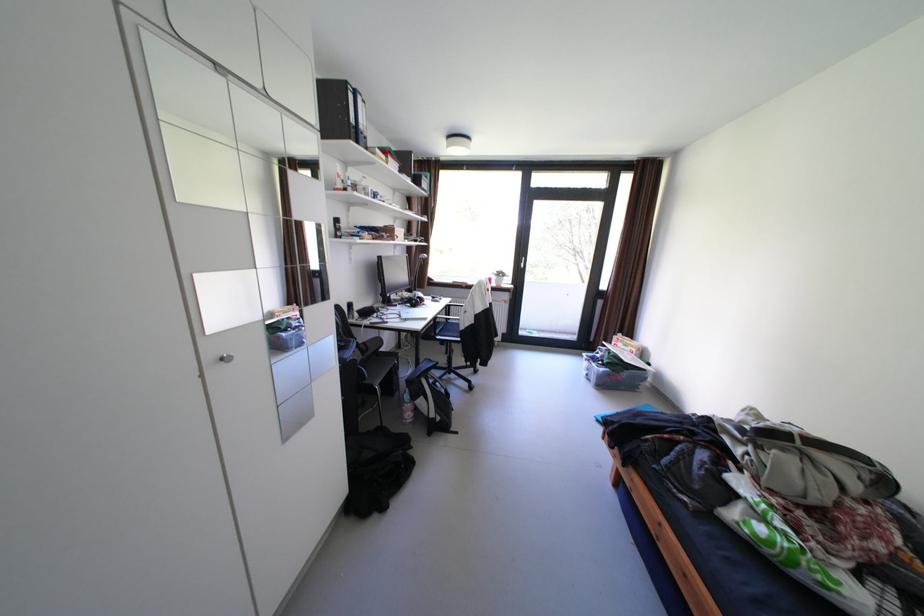
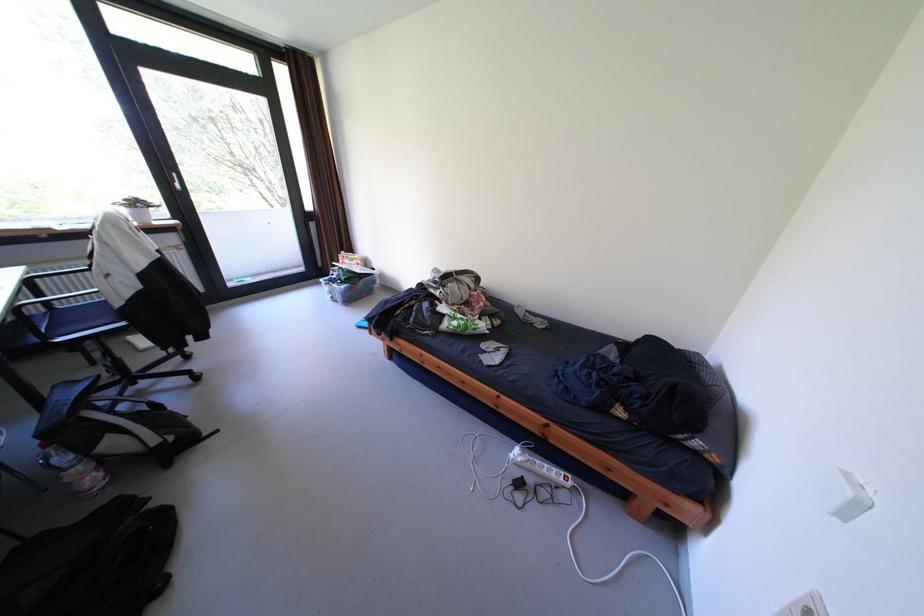
Where in the second image is the point corresponding to (619,359) from the first image?

(355, 275)